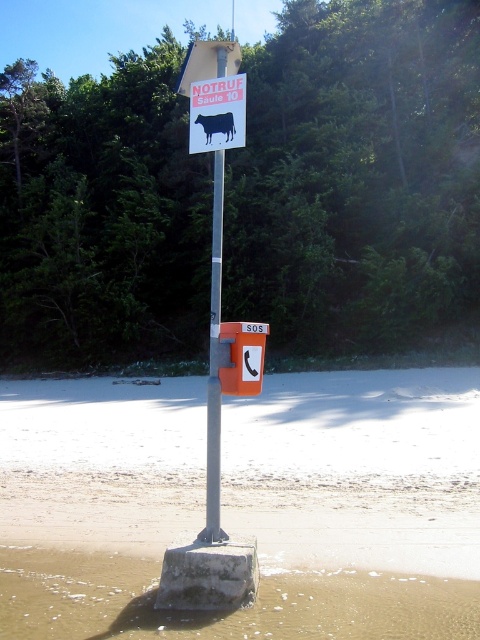
You are a tourist standing at the beach and you see the orange plastic sos phone at center and the black matte cow at center. Which object is closer to you?

The orange plastic sos phone at center is closer to you because it is in front of the black matte cow at center.